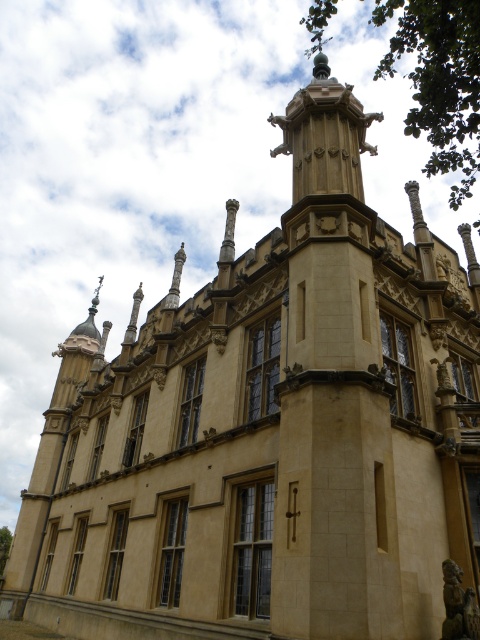
Locate an element on the screen. The image size is (480, 640). green leafy tree at upper center is located at coordinates (440, 81).

Can you confirm if green leafy tree at upper center is positioned to the left of green leafy tree at lower left?

In fact, green leafy tree at upper center is to the right of green leafy tree at lower left.

Locate an element on the screen. The width and height of the screenshot is (480, 640). green leafy tree at upper center is located at coordinates (440, 81).

In order to click on green leafy tree at upper center in this screenshot , I will do `click(440, 81)`.

What do you see at coordinates (458, 605) in the screenshot? I see `brown stone statue at lower right` at bounding box center [458, 605].

Between point (462, 636) and point (7, 540), which one is positioned behind?

Positioned behind is point (7, 540).

Identify the location of brown stone statue at lower right. Image resolution: width=480 pixels, height=640 pixels. (458, 605).

Does point (423, 68) lie in front of point (454, 621)?

No.

Is green leafy tree at upper center thinner than brown stone statue at lower right?

No.

Describe the element at coordinates (440, 81) in the screenshot. The height and width of the screenshot is (640, 480). I see `green leafy tree at upper center` at that location.

You are a GUI agent. You are given a task and a screenshot of the screen. Output one action in this format:
    pyautogui.click(x=<x>, y=<y>)
    Task: Click on the green leafy tree at upper center
    
    Given the screenshot: What is the action you would take?
    pyautogui.click(x=440, y=81)